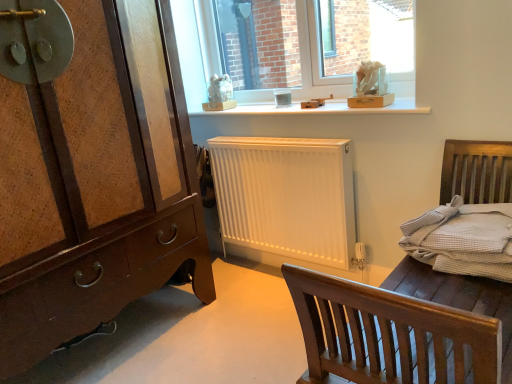
What do you see at coordinates (296, 50) in the screenshot? I see `transparent glass window at upper center` at bounding box center [296, 50].

Find the location of `transparent glass window at upper center`. transparent glass window at upper center is located at coordinates (296, 50).

Measure the distance between light gray woven bedding at right and camera.

light gray woven bedding at right is 4.01 feet from camera.

Locate an element on the screen. transparent glass window at upper center is located at coordinates (296, 50).

Considering the sizes of light gray woven bedding at right and white matte bed frame at center in the image, is light gray woven bedding at right taller or shorter than white matte bed frame at center?

Clearly, light gray woven bedding at right is shorter compared to white matte bed frame at center.

Which is closer, [458,253] or [419,272]?

Clearly, point [458,253] is closer to the camera than point [419,272].

From a real-world perspective, between light gray woven bedding at right and white matte bed frame at center, who is vertically lower?

white matte bed frame at center, from a real-world perspective.

Measure the distance between light gray woven bedding at right and white matte bed frame at center.

A distance of 5.58 inches exists between light gray woven bedding at right and white matte bed frame at center.

Can you tell me how much white wooden shelf at upper center and transparent glass window at upper center differ in facing direction?

The angular difference between white wooden shelf at upper center and transparent glass window at upper center is 0.835 degrees.

From the image's perspective, who appears lower, white wooden shelf at upper center or transparent glass window at upper center?

From the image's view, white wooden shelf at upper center is below.

Considering the sizes of objects white wooden shelf at upper center and transparent glass window at upper center in the image provided, who is thinner, white wooden shelf at upper center or transparent glass window at upper center?

transparent glass window at upper center.

Which object is further away from the camera taking this photo, white wooden shelf at upper center or transparent glass window at upper center?

transparent glass window at upper center is further from the camera.

Is brown wood chest of drawers at left outside of white wooden shelf at upper center?

Yes, brown wood chest of drawers at left is outside of white wooden shelf at upper center.

Is brown wood chest of drawers at left closer to the viewer compared to white wooden shelf at upper center?

Yes, the depth of brown wood chest of drawers at left is less than that of white wooden shelf at upper center.

Is white wooden shelf at upper center at the back of brown wood chest of drawers at left?

No, brown wood chest of drawers at left is not facing away from white wooden shelf at upper center.

From a real-world perspective, between brown wood chest of drawers at left and white wooden shelf at upper center, who is vertically higher?

white wooden shelf at upper center is physically above.

You are a GUI agent. You are given a task and a screenshot of the screen. Output one action in this format:
    pyautogui.click(x=<x>, y=<y>)
    Task: Click on the window lying behind the light gray woven bedding at right
    
    Given the screenshot: What is the action you would take?
    pyautogui.click(x=296, y=50)

Is transparent glass window at upper center in front of or behind light gray woven bedding at right in the image?

Visually, transparent glass window at upper center is located behind light gray woven bedding at right.

Would you say transparent glass window at upper center is inside or outside light gray woven bedding at right?

transparent glass window at upper center lies outside light gray woven bedding at right.

Does transparent glass window at upper center touch white matte radiator at center?

transparent glass window at upper center and white matte radiator at center are not in contact.

Which object is further away from the camera taking this photo, transparent glass window at upper center or white matte radiator at center?

white matte radiator at center is behind.

Between transparent glass window at upper center and white matte radiator at center, which one has smaller size?

Smaller between the two is white matte radiator at center.

Is transparent glass window at upper center wider than white matte radiator at center?

Correct, the width of transparent glass window at upper center exceeds that of white matte radiator at center.

Is white matte radiator at center smaller than transparent glass window at upper center?

Yes, white matte radiator at center is smaller than transparent glass window at upper center.

Which is more to the left, white matte radiator at center or transparent glass window at upper center?

white matte radiator at center.

Which of these two, white matte radiator at center or transparent glass window at upper center, is thinner?

Thinner between the two is white matte radiator at center.

Image resolution: width=512 pixels, height=384 pixels. What are the coordinates of `window in front of the white matte radiator at center` in the screenshot? It's located at (296, 50).

Locate an element on the screen. The height and width of the screenshot is (384, 512). bedding that is in front of the white wooden shelf at upper center is located at coordinates (463, 239).

Does point (226, 114) lie in front of point (503, 222)?

That is False.

Does white wooden shelf at upper center have a lesser height compared to light gray woven bedding at right?

Yes.

From a real-world perspective, between white wooden shelf at upper center and light gray woven bedding at right, who is vertically higher?

In real-world perspective, white wooden shelf at upper center is above.

Locate an element on the screen. The image size is (512, 384). bed frame on the left of light gray woven bedding at right is located at coordinates (475, 168).

Where is `window sill that is in front of the transparent glass window at upper center`? window sill that is in front of the transparent glass window at upper center is located at coordinates (320, 109).

Looking at the image, which one is located further to light gray woven bedding at right, transparent glass window at upper center or white matte bed frame at center?

The object further to light gray woven bedding at right is transparent glass window at upper center.

Considering their positions, is white matte radiator at center positioned closer to white matte bed frame at center than white wooden shelf at upper center?

white matte radiator at center lies closer to white matte bed frame at center than the other object.

From the image, which object appears to be nearer to transparent glass window at upper center, white wooden shelf at upper center or light gray woven bedding at right?

Among the two, white wooden shelf at upper center is located nearer to transparent glass window at upper center.

When comparing their distances from transparent glass window at upper center, does brown wood chest of drawers at left or light gray woven bedding at right seem closer?

light gray woven bedding at right lies closer to transparent glass window at upper center than the other object.

When comparing their distances from brown wood chest of drawers at left, does transparent glass window at upper center or light gray woven bedding at right seem further?

Among the two, light gray woven bedding at right is located further to brown wood chest of drawers at left.

Looking at the image, which one is located closer to white matte bed frame at center, white wooden shelf at upper center or transparent glass window at upper center?

Based on the image, white wooden shelf at upper center appears to be nearer to white matte bed frame at center.

Considering their positions, is brown wood chest of drawers at left positioned further to transparent glass window at upper center than white matte bed frame at center?

The object further to transparent glass window at upper center is white matte bed frame at center.

From the image, which object appears to be nearer to transparent glass window at upper center, white matte bed frame at center or white wooden shelf at upper center?

Based on the image, white wooden shelf at upper center appears to be nearer to transparent glass window at upper center.

Where is `window sill between white matte bed frame at center and white matte radiator at center in the front-back direction`? Image resolution: width=512 pixels, height=384 pixels. window sill between white matte bed frame at center and white matte radiator at center in the front-back direction is located at coordinates coord(320,109).

The height and width of the screenshot is (384, 512). In order to click on bedding that lies between transparent glass window at upper center and white matte bed frame at center from top to bottom in this screenshot , I will do `click(463, 239)`.

Identify the location of window between white matte bed frame at center and white matte radiator at center in the front-back direction. (296, 50).

Locate an element on the screen. The image size is (512, 384). bedding between white matte bed frame at center and white wooden shelf at upper center from front to back is located at coordinates (463, 239).